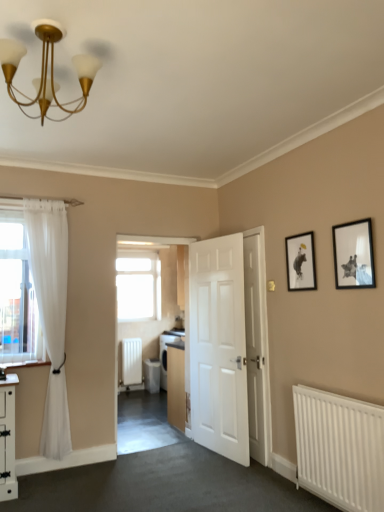
Question: Is white glossy dishwasher at center with black matte picture frame at upper right, which is counted as the second picture frame, starting from the left?

Choices:
 (A) no
 (B) yes

Answer: (A)

Question: Considering the relative sizes of white glossy dishwasher at center and black matte picture frame at upper right, which is the second picture frame from back to front, in the image provided, is white glossy dishwasher at center bigger than black matte picture frame at upper right, which is the second picture frame from back to front,?

Choices:
 (A) yes
 (B) no

Answer: (A)

Question: Considering the relative sizes of white glossy dishwasher at center and black matte picture frame at upper right, acting as the 1th picture frame starting from the front, in the image provided, is white glossy dishwasher at center smaller than black matte picture frame at upper right, acting as the 1th picture frame starting from the front,?

Choices:
 (A) no
 (B) yes

Answer: (A)

Question: Would you say black matte picture frame at upper right, the 1th picture frame from the right, is part of white glossy dishwasher at center's contents?

Choices:
 (A) yes
 (B) no

Answer: (B)

Question: Is white glossy dishwasher at center positioned beyond the bounds of black matte picture frame at upper right, which is the second picture frame from back to front?

Choices:
 (A) no
 (B) yes

Answer: (B)

Question: Considering the relative sizes of white glossy dishwasher at center and black matte picture frame at upper right, the 1th picture frame from the right, in the image provided, is white glossy dishwasher at center thinner than black matte picture frame at upper right, the 1th picture frame from the right,?

Choices:
 (A) yes
 (B) no

Answer: (B)

Question: From a real-world perspective, does gold metallic chandelier at upper left sit lower than black matte picture frame at upper right, which is the second picture frame from back to front?

Choices:
 (A) yes
 (B) no

Answer: (B)

Question: Is the position of gold metallic chandelier at upper left less distant than that of black matte picture frame at upper right, acting as the 1th picture frame starting from the front?

Choices:
 (A) no
 (B) yes

Answer: (B)

Question: From the image's perspective, is gold metallic chandelier at upper left located above black matte picture frame at upper right, acting as the 1th picture frame starting from the front?

Choices:
 (A) no
 (B) yes

Answer: (B)

Question: Can you see gold metallic chandelier at upper left touching black matte picture frame at upper right, the 1th picture frame from the right?

Choices:
 (A) yes
 (B) no

Answer: (B)

Question: Is black matte picture frame at upper right, acting as the 1th picture frame starting from the front, a part of gold metallic chandelier at upper left?

Choices:
 (A) no
 (B) yes

Answer: (A)

Question: Is gold metallic chandelier at upper left taller than black matte picture frame at upper right, acting as the 1th picture frame starting from the front?

Choices:
 (A) yes
 (B) no

Answer: (B)

Question: Is white matte radiator at center, arranged as the 2th radiator when viewed from the front, far from white glossy dishwasher at center?

Choices:
 (A) no
 (B) yes

Answer: (A)